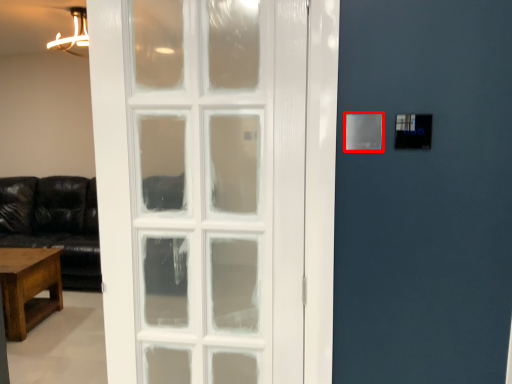
Question: From the image's perspective, where is light switch (annotated by the red box) located in relation to table in the image?

Choices:
 (A) below
 (B) above

Answer: (B)